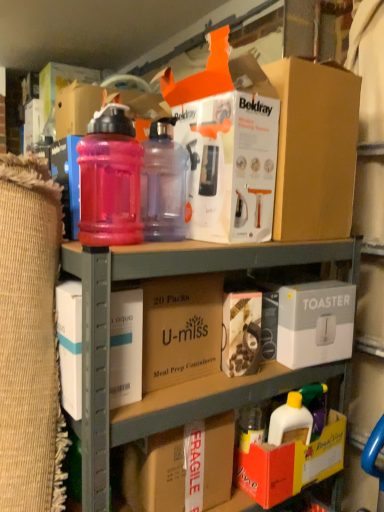
Question: Does white cardboard box at upper center, the 2th box when ordered from bottom to top, come behind white cardboard box at left, which is counted as the 1th box, starting from the front?

Choices:
 (A) yes
 (B) no

Answer: (A)

Question: Is white cardboard box at upper center, the 1th box from the right, in front of white cardboard box at left, which is counted as the 1th box, starting from the front?

Choices:
 (A) no
 (B) yes

Answer: (A)

Question: Can you see white cardboard box at upper center, arranged as the 2th box when viewed from the front, touching white cardboard box at left, positioned as the second box in right-to-left order?

Choices:
 (A) yes
 (B) no

Answer: (B)

Question: Can you confirm if white cardboard box at upper center, the 2th box when ordered from bottom to top, is bigger than white cardboard box at left, which is counted as the 1th box, starting from the front?

Choices:
 (A) no
 (B) yes

Answer: (B)

Question: Is white cardboard box at upper center, the 1th box from the right, to the right of white cardboard box at left, which is the first box in left-to-right order, from the viewer's perspective?

Choices:
 (A) no
 (B) yes

Answer: (B)

Question: Would you say white cardboard box at upper center, which is the 1th box from top to bottom, is outside white cardboard box at left, which is the second box in top-to-bottom order?

Choices:
 (A) yes
 (B) no

Answer: (A)

Question: Considering the relative sizes of brown cardboard at center, which is counted as the 2th cardboard box, starting from the bottom, and white cardboard box at left, placed as the 2th box when sorted from back to front, in the image provided, is brown cardboard at center, which is counted as the 2th cardboard box, starting from the bottom, wider than white cardboard box at left, placed as the 2th box when sorted from back to front,?

Choices:
 (A) no
 (B) yes

Answer: (B)

Question: Is brown cardboard at center, the 1th cardboard box from the top, behind white cardboard box at left, marked as the first box in a bottom-to-top arrangement?

Choices:
 (A) yes
 (B) no

Answer: (A)

Question: From a real-world perspective, is brown cardboard at center, the 1th cardboard box from the top, beneath white cardboard box at left, marked as the first box in a bottom-to-top arrangement?

Choices:
 (A) yes
 (B) no

Answer: (B)

Question: Can you confirm if brown cardboard at center, which is counted as the 2th cardboard box, starting from the bottom, is positioned to the right of white cardboard box at left, placed as the 2th box when sorted from back to front?

Choices:
 (A) no
 (B) yes

Answer: (B)

Question: From the image's perspective, is brown cardboard at center, which is counted as the 2th cardboard box, starting from the bottom, below white cardboard box at left, placed as the 2th box when sorted from back to front?

Choices:
 (A) no
 (B) yes

Answer: (A)

Question: Is brown cardboard at center, the 1th cardboard box from the top, with white cardboard box at left, positioned as the second box in right-to-left order?

Choices:
 (A) no
 (B) yes

Answer: (A)

Question: From a real-world perspective, does fragile cardboard box at lower center, acting as the first cardboard box starting from the bottom, sit lower than brown cardboard at center, which is counted as the 2th cardboard box, starting from the bottom?

Choices:
 (A) no
 (B) yes

Answer: (B)